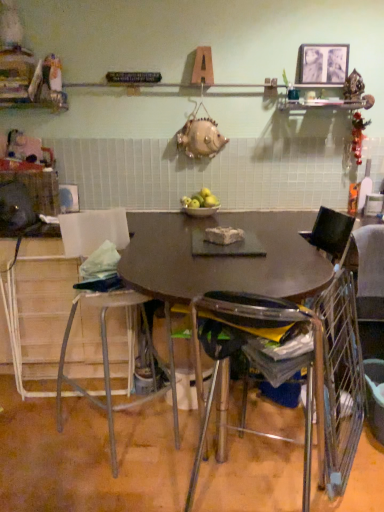
Question: In terms of size, does metallic silver picture frame at upper right appear bigger or smaller than metallic stool at lower left, the 3th chair from the right?

Choices:
 (A) big
 (B) small

Answer: (B)

Question: From the image's perspective, is metallic silver picture frame at upper right located above or below metallic stool at lower left, which is the 1th chair from left to right?

Choices:
 (A) below
 (B) above

Answer: (B)

Question: Which object is the farthest from the matte brown table at center?

Choices:
 (A) metallic wire chair at right, arranged as the first chair when viewed from the right
 (B) metallic stool at lower left, which is the 1th chair from left to right
 (C) clear plastic chair at center, the 2th chair in the left-to-right sequence
 (D) green matte apples at center
 (E) metallic silver picture frame at upper right

Answer: (E)

Question: Based on their relative distances, which object is farther from the matte brown table at center?

Choices:
 (A) metallic wire chair at right, arranged as the first chair when viewed from the right
 (B) green matte apples at center
 (C) metallic silver picture frame at upper right
 (D) metallic stool at lower left, which is the 1th chair from left to right
 (E) clear plastic chair at center, the second chair from the right

Answer: (C)